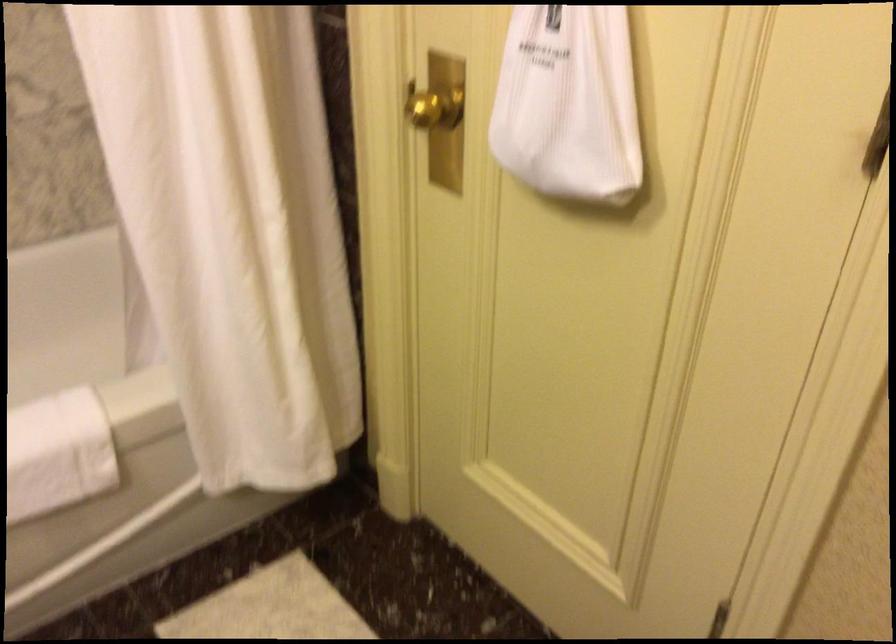
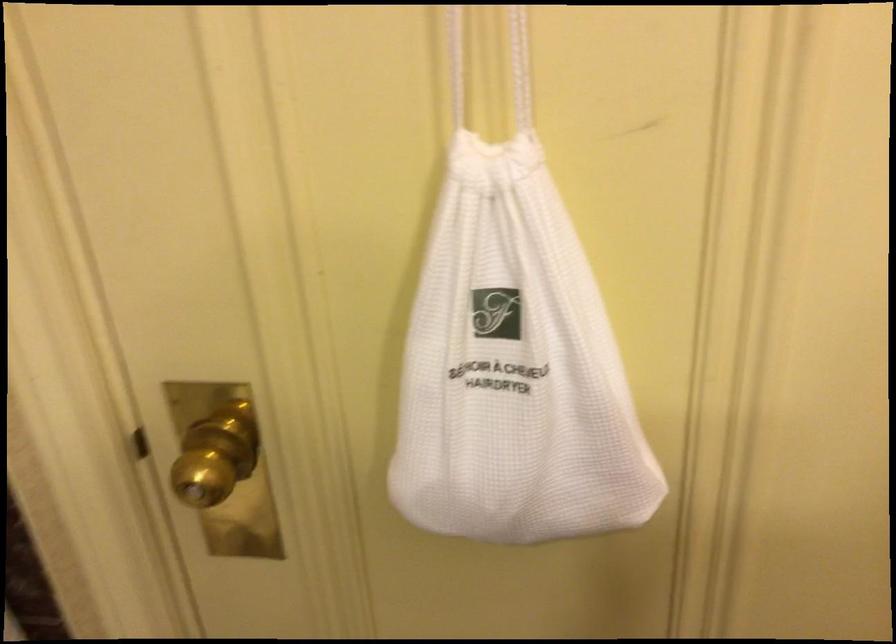
The point at (435, 93) is marked in the first image. Where is the corresponding point in the second image?

(216, 456)